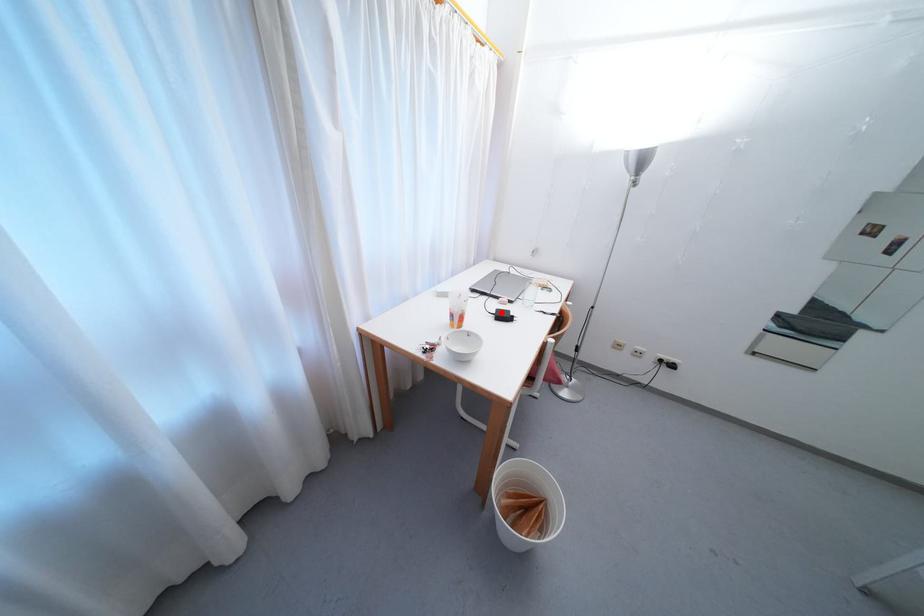
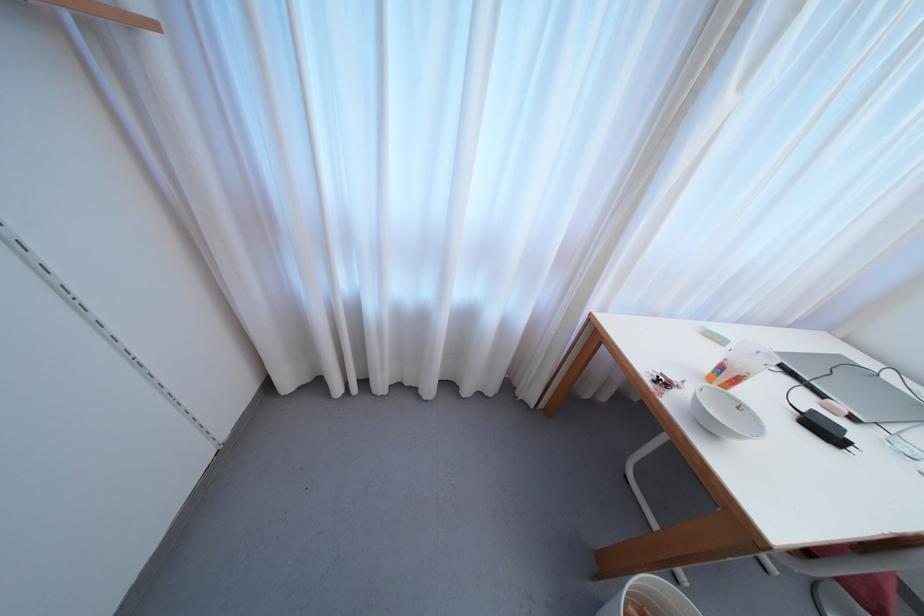
The point at the highlighted location is marked in the first image. Where is the corresponding point in the second image?

(817, 415)